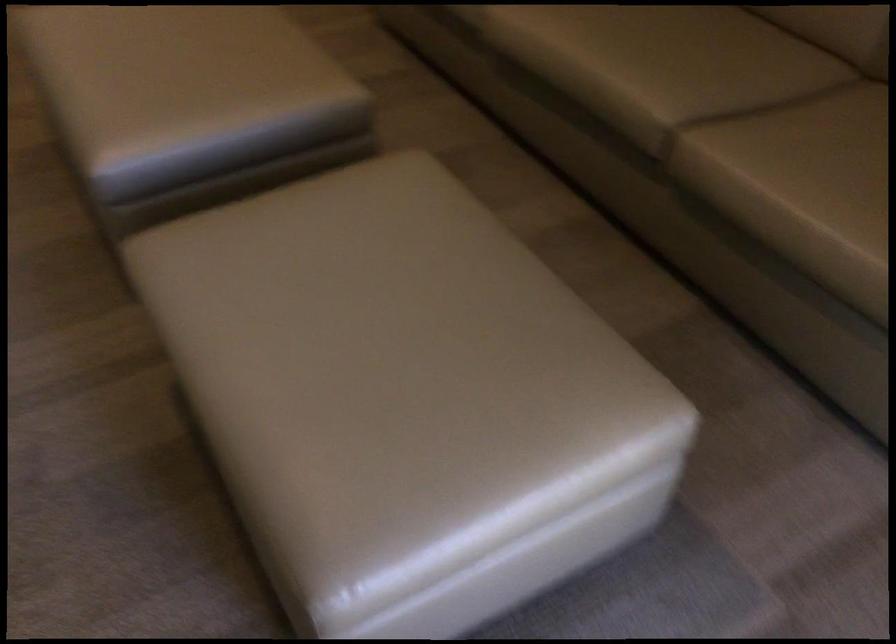
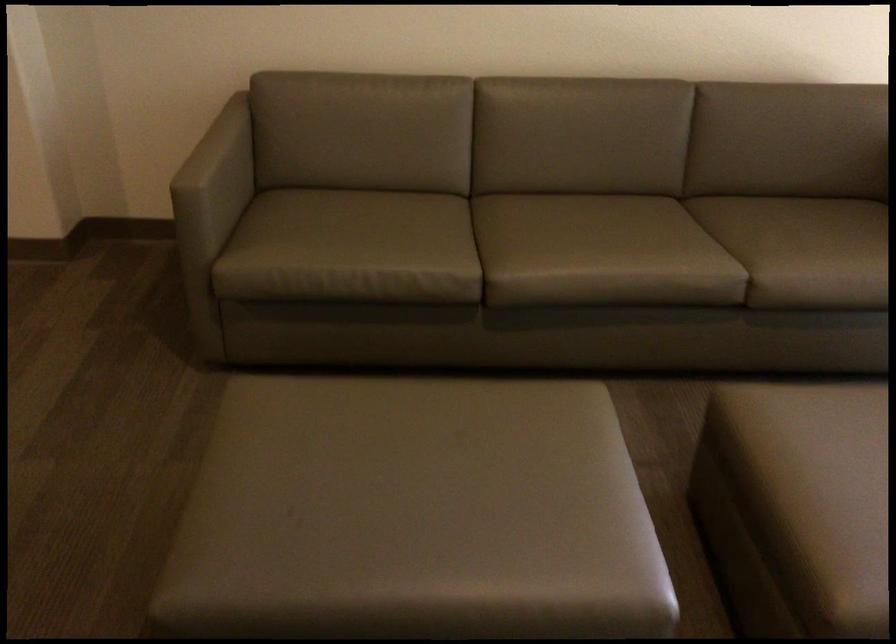
Find the pixel in the second image that matches pixel 337 220 in the first image.

(814, 464)